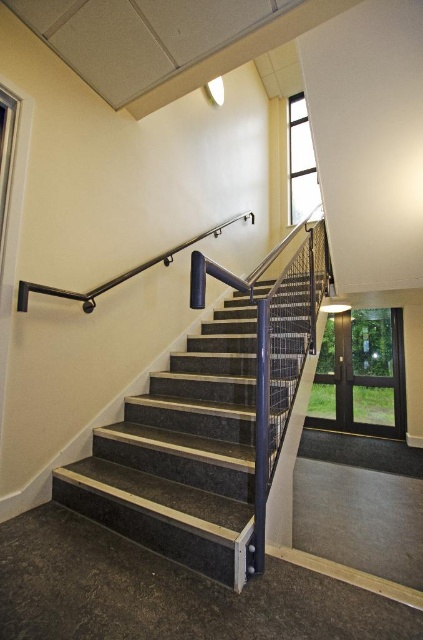
Is marble stairs at center in front of black metal handrail at upper center?

Yes.

Based on the photo, who is taller, marble stairs at center or black metal handrail at upper center?

black metal handrail at upper center

Who is more distant from viewer, (271, 474) or (192, 237)?

The point (192, 237) is more distant.

The width and height of the screenshot is (423, 640). Identify the location of marble stairs at center. (183, 454).